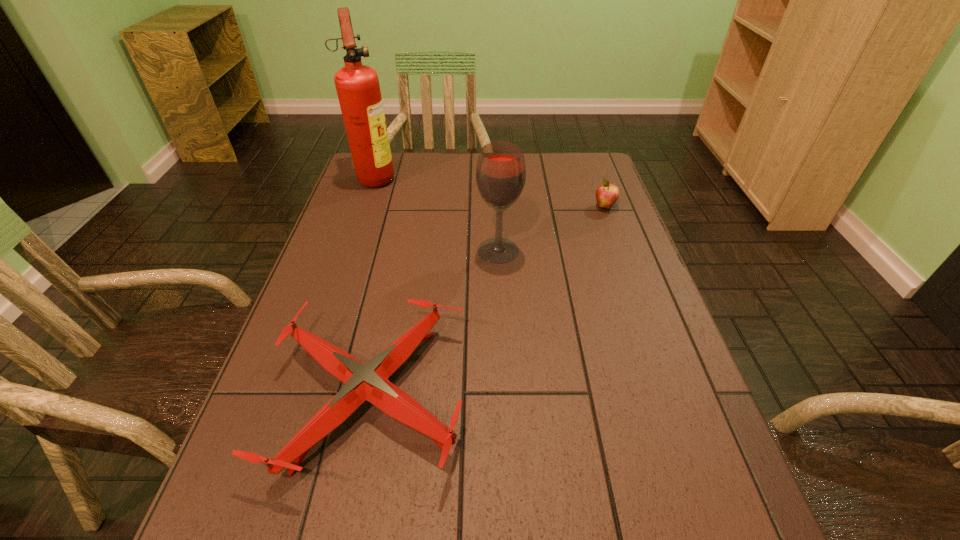
Identify the location of vacant region located 0.270m on the left of the second farthest object. (503, 207).

The image size is (960, 540). I want to click on free region located 0.300m on the right of the drone, so [620, 395].

At what (x,y) coordinates should I click in order to perform the action: click on object that is at the far edge. Please return your answer as a coordinate pair (x, y). The image size is (960, 540). Looking at the image, I should click on (358, 89).

Identify the location of fire extinguisher situated at the left edge. This screenshot has width=960, height=540. point(358,89).

This screenshot has height=540, width=960. In order to click on drone that is positioned at the left edge in this screenshot , I will do `click(369, 382)`.

Image resolution: width=960 pixels, height=540 pixels. I want to click on object situated at the right edge, so click(x=607, y=194).

Where is `object located at the far left corner`? object located at the far left corner is located at coordinates (358, 89).

In the image, there is a desktop. Identify the location of vacant space at the far edge. Image resolution: width=960 pixels, height=540 pixels. (453, 188).

You are a GUI agent. You are given a task and a screenshot of the screen. Output one action in this format:
    pyautogui.click(x=<x>, y=<y>)
    Task: Click on the vacant position at the near edge of the desktop
    Image resolution: width=960 pixels, height=540 pixels.
    Given the screenshot: What is the action you would take?
    pyautogui.click(x=396, y=535)

You are a GUI agent. You are given a task and a screenshot of the screen. Output one action in this format:
    pyautogui.click(x=<x>, y=<y>)
    Task: Click on the free location at the left edge
    This screenshot has width=960, height=540.
    Given the screenshot: What is the action you would take?
    pyautogui.click(x=327, y=253)